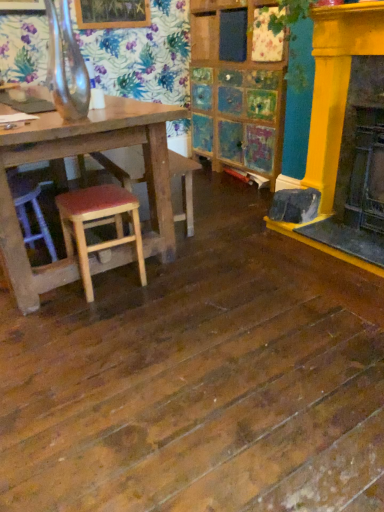
Where is `vacant area that lies in front of wooden stool with red cushion at lower left`? This screenshot has width=384, height=512. vacant area that lies in front of wooden stool with red cushion at lower left is located at coordinates (98, 318).